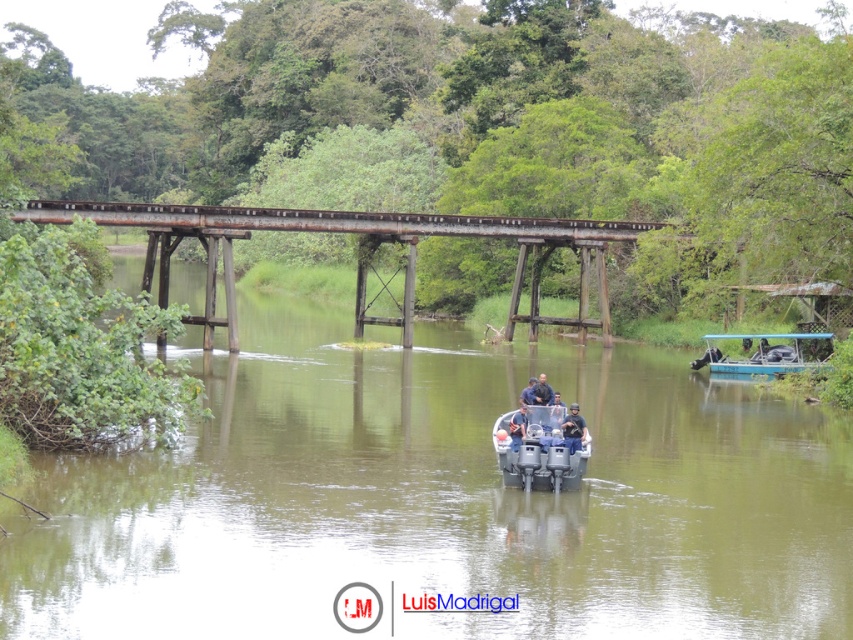
Question: Can you confirm if dark blue uniform at center is positioned to the left of dark blue fabric at center?

Choices:
 (A) yes
 (B) no

Answer: (B)

Question: Among these points, which one is farthest from the camera?

Choices:
 (A) (161, 276)
 (B) (520, 394)

Answer: (A)

Question: Can you confirm if blue plastic boat at right is positioned above dark blue shirt at center?

Choices:
 (A) yes
 (B) no

Answer: (B)

Question: Does rusty metal bridge at center have a smaller size compared to metallic gray boat at center?

Choices:
 (A) no
 (B) yes

Answer: (A)

Question: Which object is closer to the camera taking this photo?

Choices:
 (A) rusty metal bridge at center
 (B) dark blue fabric at center
 (C) metallic gray boat at center

Answer: (C)

Question: Considering the real-world distances, which object is farthest from the blue plastic boat at right?

Choices:
 (A) metallic gray boat at center
 (B) dark blue fabric at center
 (C) rusty metal bridge at center
 (D) dark blue shirt at center

Answer: (A)